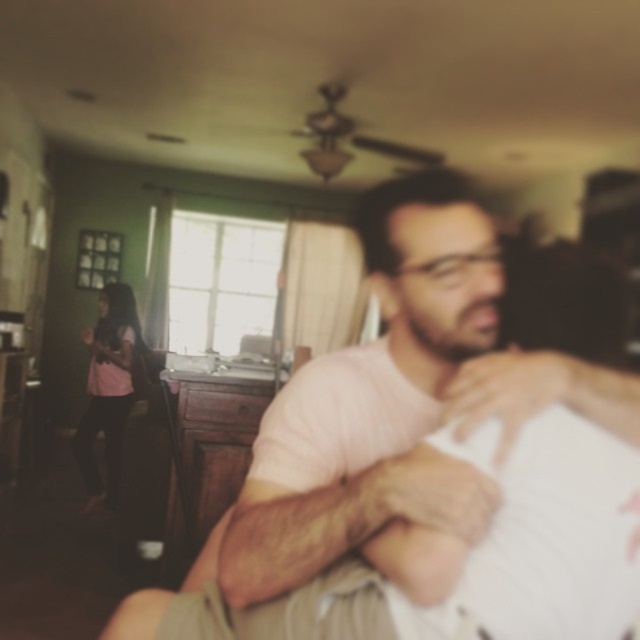
You are standing in the living room and want to reach the point marked at coordinates (458, 307). If your arm is 90 centimeters long, can you reach that point without moving your feet?

The point marked at coordinates (458, 307) is 91.65 centimeters away from you. Since your arm is only 90 centimeters long, you cannot reach it without moving your feet.

In the scene shown: You are standing in the living room and see the pink cotton shirt at center and the pink fabric shirt at left. Which one is higher up in the image?

The pink cotton shirt at center is located above the pink fabric shirt at left, so it is higher up in the image.

You are standing in the living room and see the pink cotton shirt at center and the pink fabric shirt at left. Which one is nearer to you?

The pink cotton shirt at center is closer to the viewer than the pink fabric shirt at left.